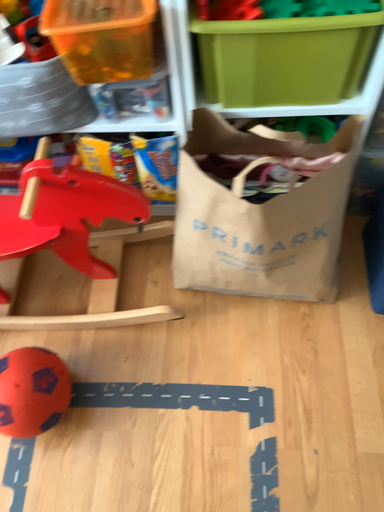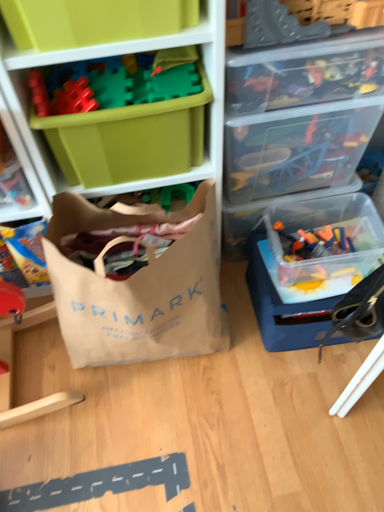
Question: How did the camera likely rotate when shooting the video?

Choices:
 (A) rotated downward
 (B) rotated upward

Answer: (B)